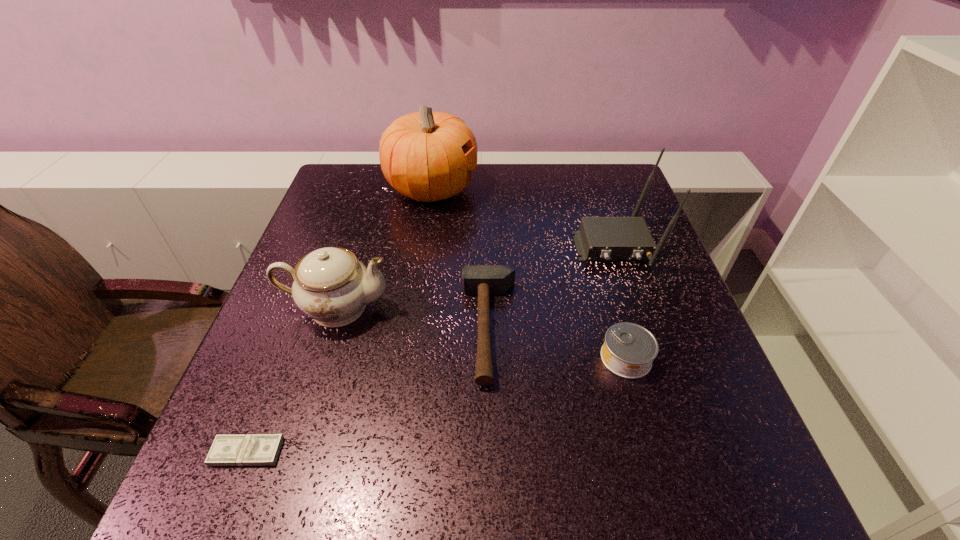
The width and height of the screenshot is (960, 540). Identify the location of pumpkin. (427, 156).

You are a GUI agent. You are given a task and a screenshot of the screen. Output one action in this format:
    pyautogui.click(x=<x>, y=<y>)
    Task: Click on the router
    The height and width of the screenshot is (540, 960).
    Given the screenshot: What is the action you would take?
    pyautogui.click(x=599, y=238)

At what (x,y) coordinates should I click in order to perform the action: click on the third tallest object. Please return your answer as a coordinate pair (x, y). This screenshot has width=960, height=540. Looking at the image, I should click on (330, 285).

The height and width of the screenshot is (540, 960). In order to click on can in this screenshot , I will do `click(629, 349)`.

The image size is (960, 540). I want to click on hammer, so click(x=483, y=280).

Locate an element on the screen. the nearest object is located at coordinates (250, 449).

Where is `the shortest object`? The width and height of the screenshot is (960, 540). the shortest object is located at coordinates (250, 449).

Locate an element on the screen. This screenshot has width=960, height=540. vacant point located on the front-facing side of the farthest object is located at coordinates (600, 189).

Locate an element on the screen. The height and width of the screenshot is (540, 960). vacant region located on the back of the router to connect cables is located at coordinates (653, 359).

Find the location of a particular element. The image size is (960, 540). vacant space located at the spout of the third tallest object is located at coordinates (469, 308).